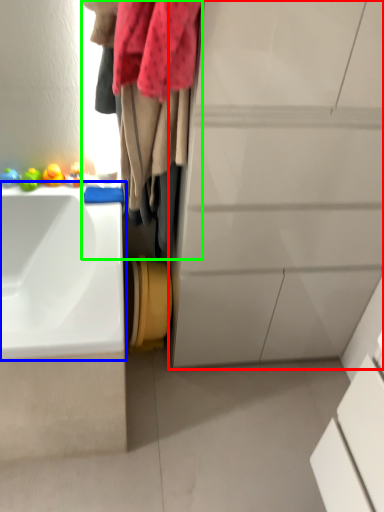
Question: Which object is positioned closest to bathroom cabinet (highlighted by a red box)? Select from sink (highlighted by a blue box) and laundry (highlighted by a green box).

Choices:
 (A) sink
 (B) laundry

Answer: (B)